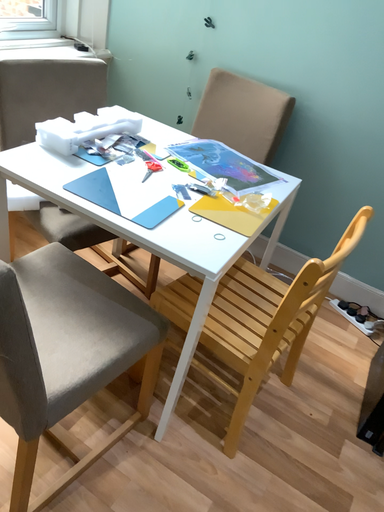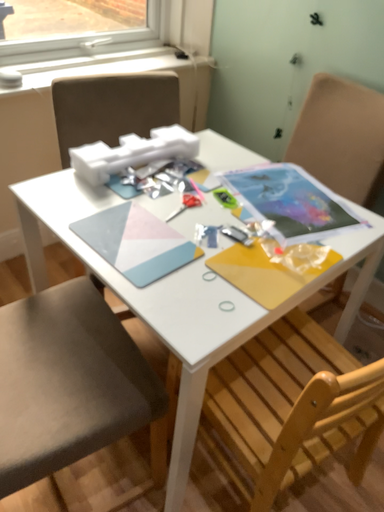
Question: How did the camera likely rotate when shooting the video?

Choices:
 (A) rotated right
 (B) rotated left

Answer: (B)